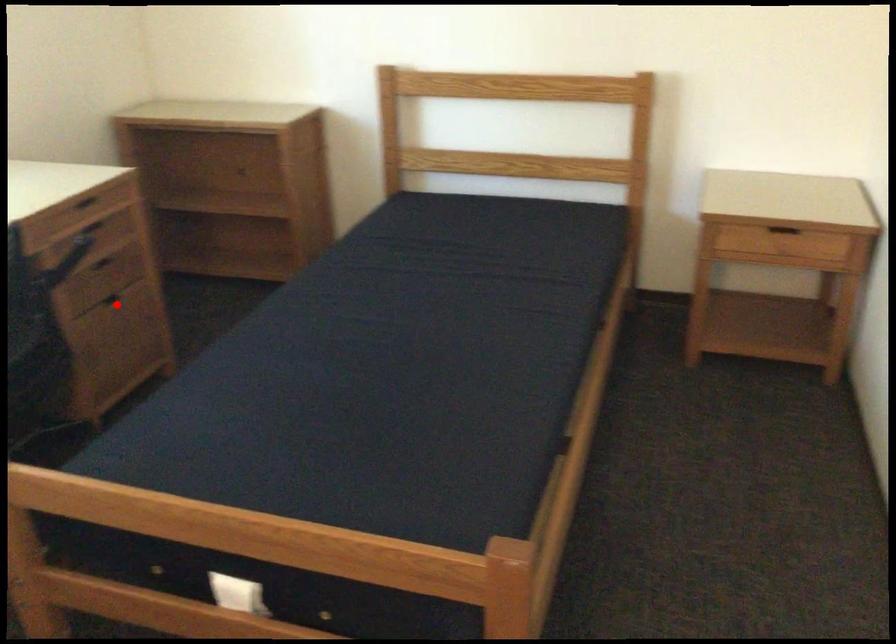
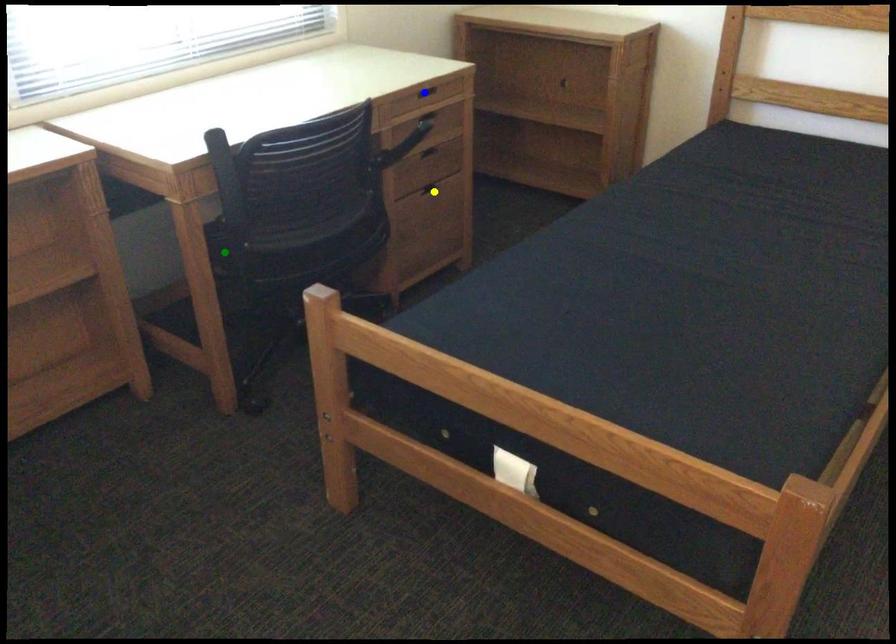
Question: I am providing you with two images of the same scene from different viewpoints. A red point is marked on the first image. You are given multiple points on the second image. Which spot in image 2 lines up with the point in image 1?

Choices:
 (A) blue point
 (B) green point
 (C) yellow point

Answer: (C)